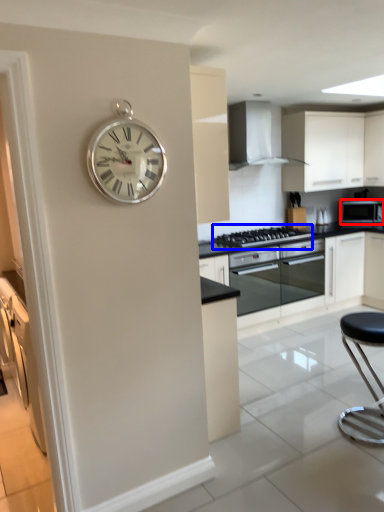
Question: Which object is further to the camera taking this photo, microwave oven (highlighted by a red box) or gas stove (highlighted by a blue box)?

Choices:
 (A) microwave oven
 (B) gas stove

Answer: (A)